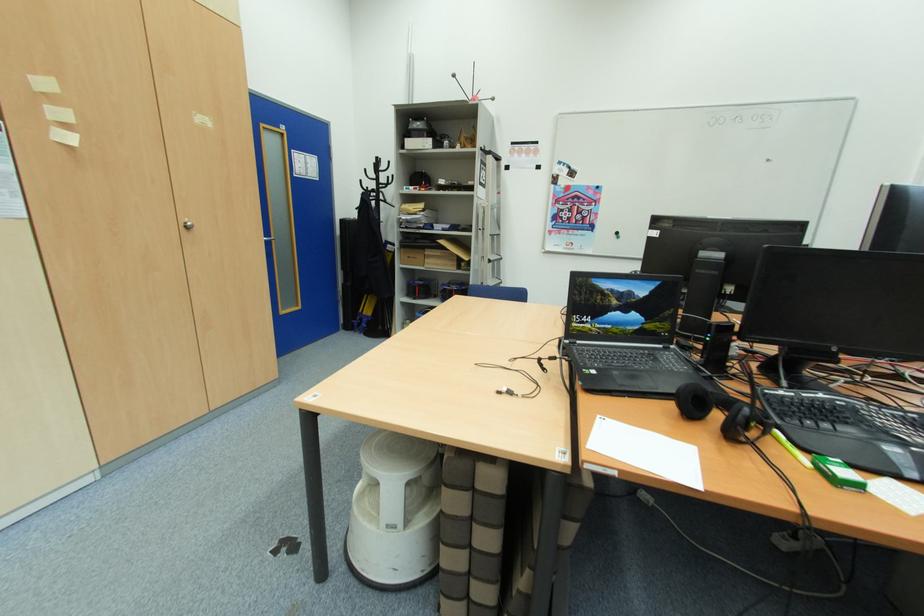
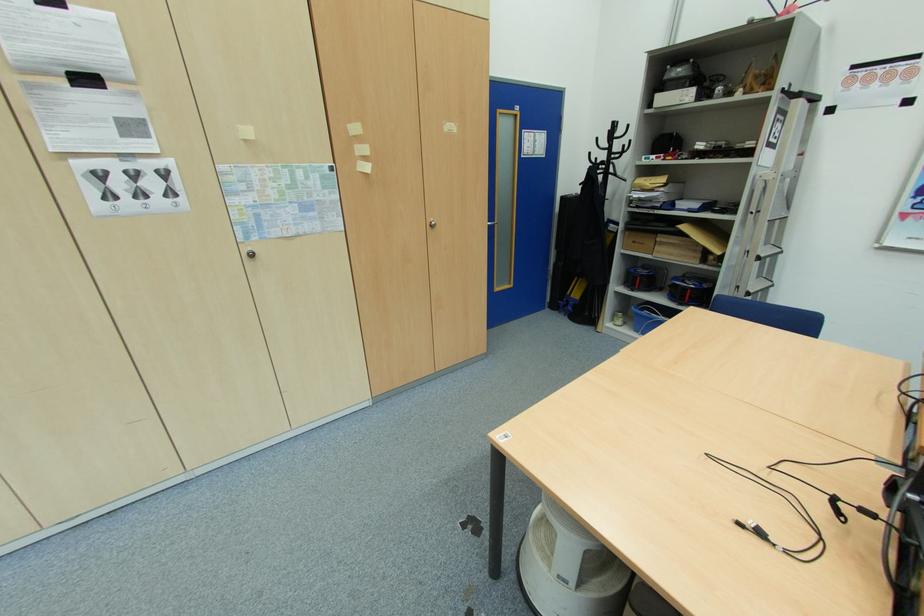
In the second image, find the point that corresponds to pixel 373 177 in the first image.

(605, 147)